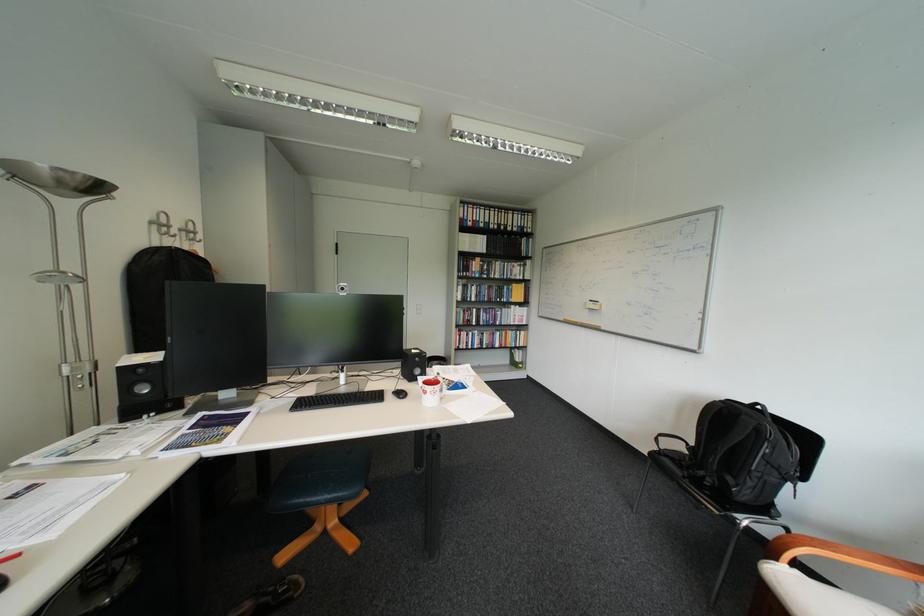
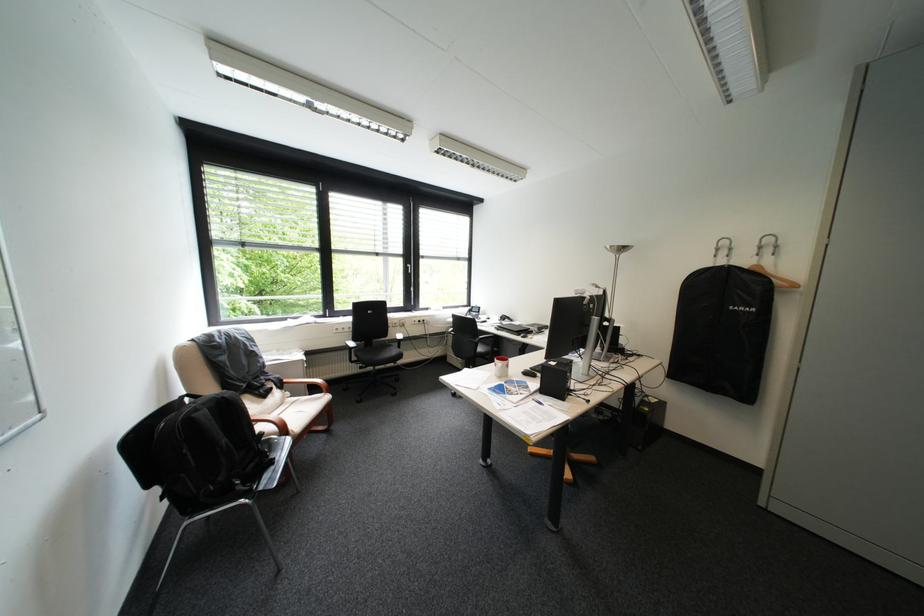
Find the pixel in the second image that matches pixel 756 418 in the first image.

(236, 398)